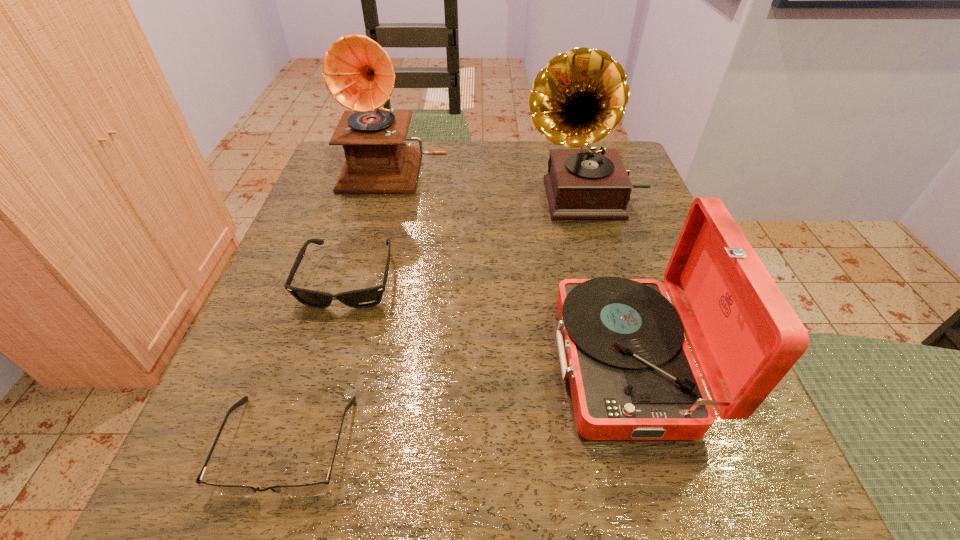
Find the location of `the leftmost phonograph_record`. the leftmost phonograph_record is located at coordinates (358, 73).

Where is `the shortest phonograph_record`? This screenshot has height=540, width=960. the shortest phonograph_record is located at coordinates (621, 343).

What are the coordinates of `the nearest phonograph_record` in the screenshot? It's located at (621, 343).

Where is `sunglasses`? sunglasses is located at coordinates (362, 298).

The image size is (960, 540). What are the coordinates of `spectacles` in the screenshot? It's located at [315, 489].

Identify the location of free spot located on the horn of the leftmost phonograph_record. (372, 264).

Find the location of `blank area located on the front-facing side of the shortest phonograph_record`. blank area located on the front-facing side of the shortest phonograph_record is located at coordinates (284, 362).

At what (x,y) coordinates should I click in order to perform the action: click on vacant space located 0.360m on the front-facing side of the shortest phonograph_record. Please return your answer as a coordinate pair (x, y). The height and width of the screenshot is (540, 960). Looking at the image, I should click on tap(312, 362).

In order to click on vacant space located 0.230m on the front-facing side of the shortest phonograph_record in this screenshot , I will do `click(400, 362)`.

You are a GUI agent. You are given a task and a screenshot of the screen. Output one action in this format:
    pyautogui.click(x=<x>, y=<y>)
    Task: Click on the free location located on the front-facing side of the sunglasses
    
    Given the screenshot: What is the action you would take?
    pyautogui.click(x=324, y=367)